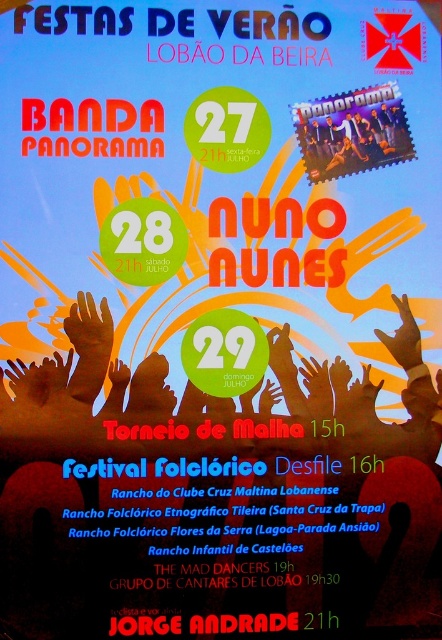
Is brown matte hands at center to the left of matte black band at upper right from the viewer's perspective?

Correct, you'll find brown matte hands at center to the left of matte black band at upper right.

Does brown matte hands at center have a greater height compared to matte black band at upper right?

Yes.

Is point (72, 342) positioned after point (320, 118)?

No, it is not.

The width and height of the screenshot is (442, 640). In order to click on brown matte hands at center in this screenshot , I will do `click(79, 390)`.